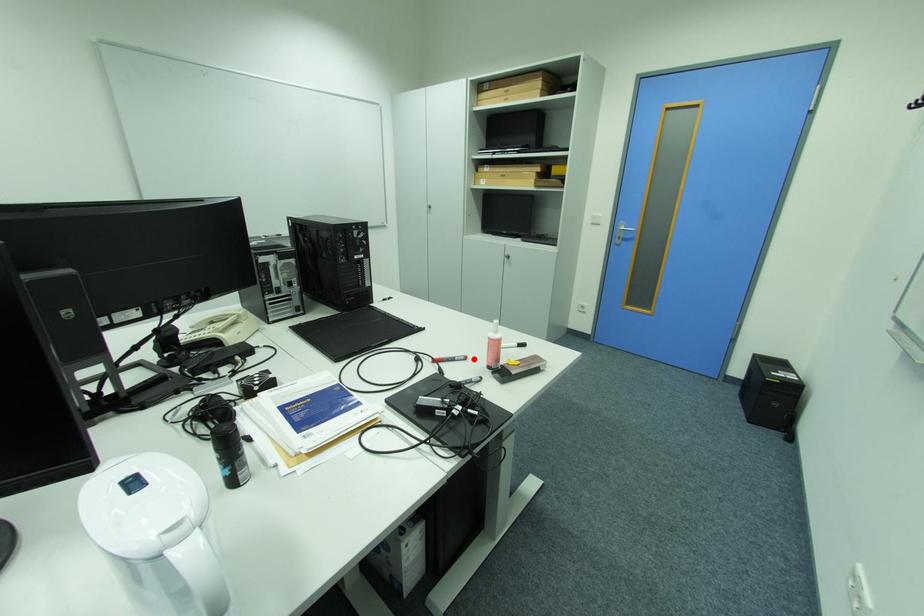
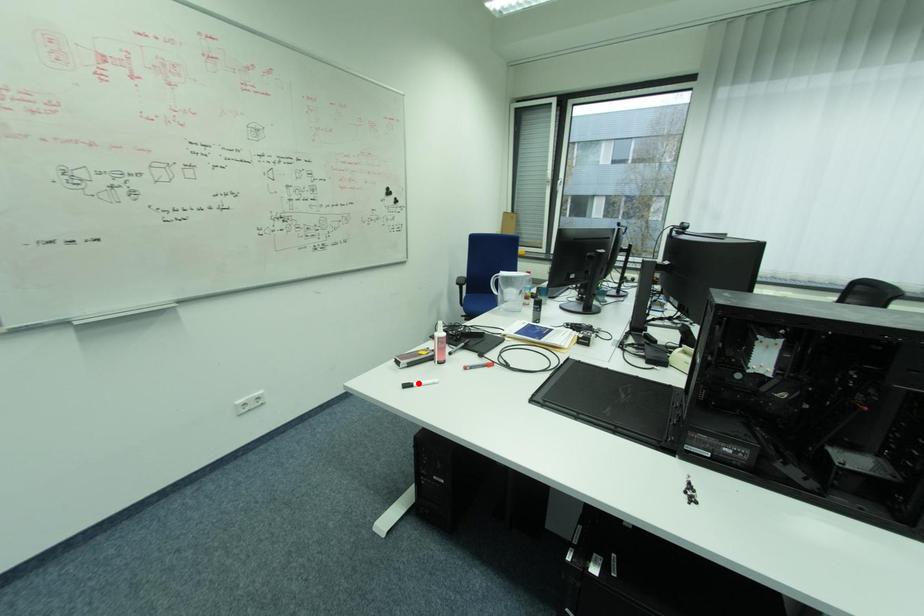
I am providing you with two images of the same scene from different viewpoints. A red point is marked on the first image and another point is marked on the second image. Do the highlighted points in image1 and image2 indicate the same real-world spot?

No